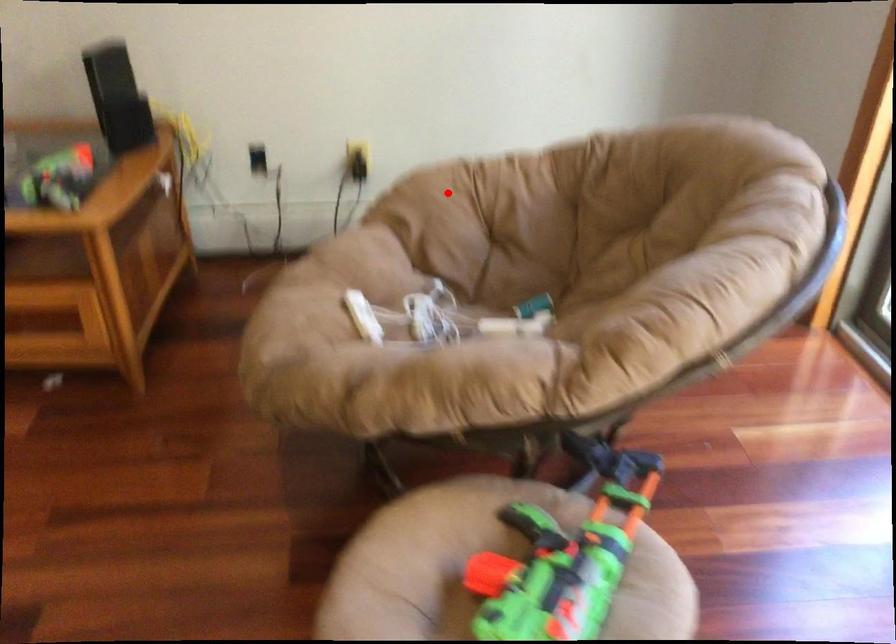
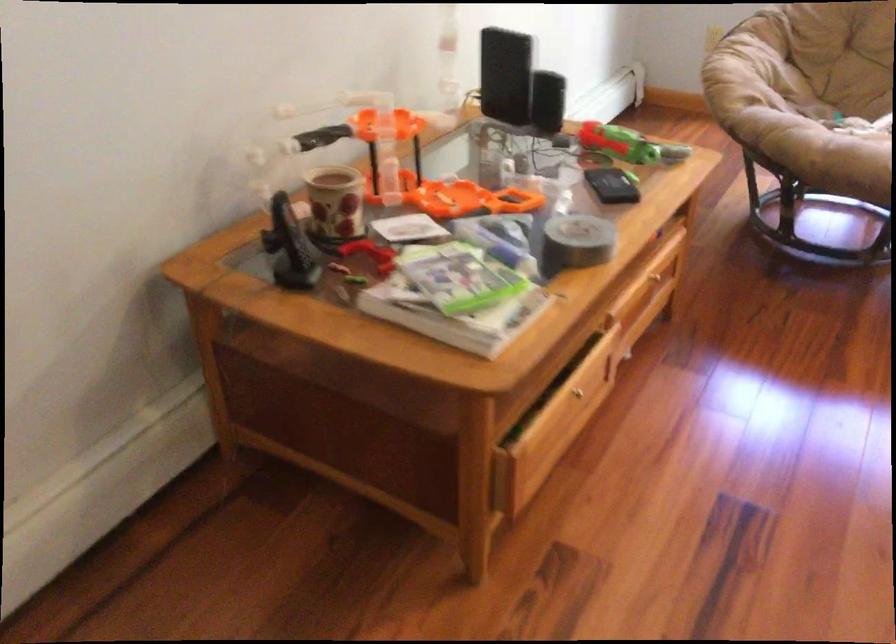
Question: I am providing you with two images of the same scene from different viewpoints. Given a red point in image1, look at the same physical point in image2. Is it:

Choices:
 (A) Closer to the viewpoint
 (B) Farther from the viewpoint

Answer: (B)